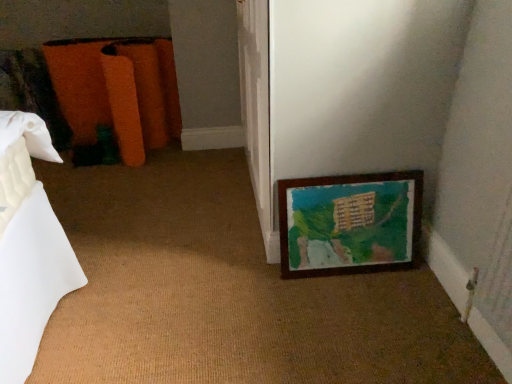
The image size is (512, 384). I want to click on free region on the left part of wooden picture frame at lower right, so click(x=256, y=275).